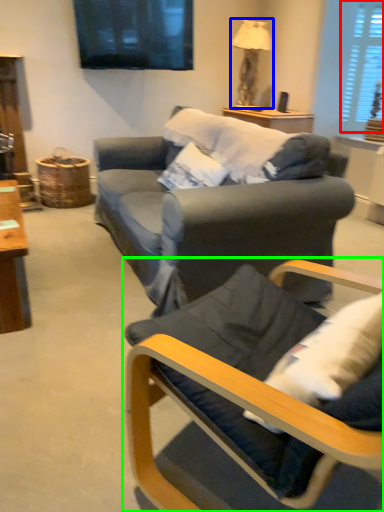
Question: Considering the real-world distances, which object is closest to window (highlighted by a red box)? lamp (highlighted by a blue box) or chair (highlighted by a green box).

Choices:
 (A) lamp
 (B) chair

Answer: (A)